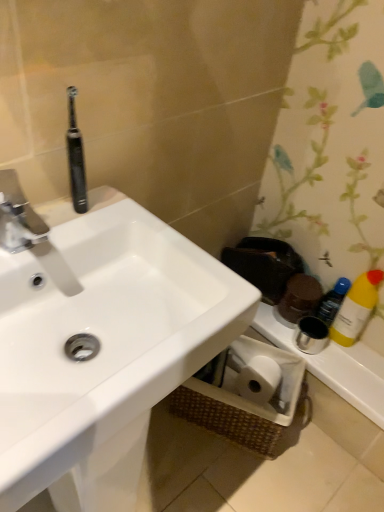
Locate an element on the screen. Image resolution: width=384 pixels, height=512 pixels. unoccupied space behind silver metallic faucet at upper left is located at coordinates (x=79, y=216).